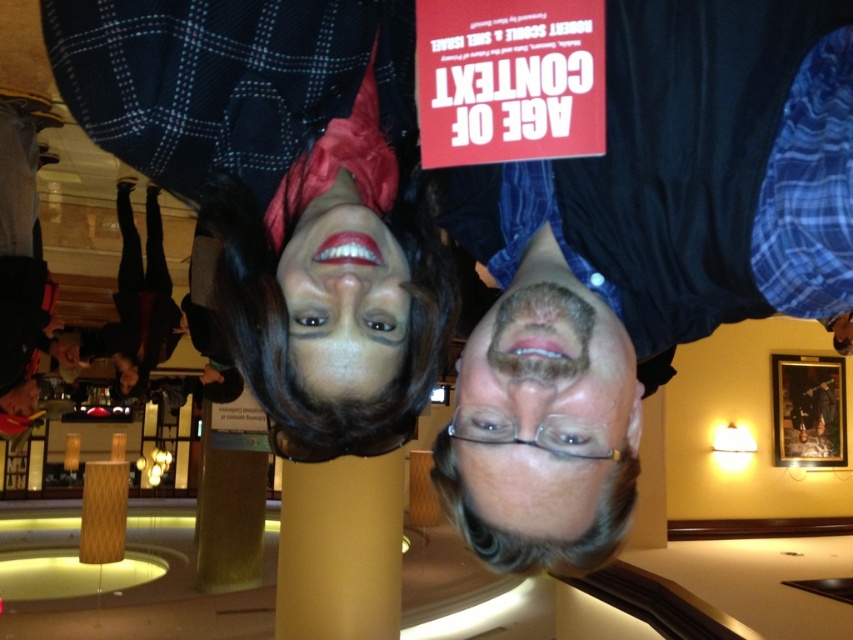
You are a photographer trying to capture a closeup shot of both the dark blue shirt at center and the matte black wig at center. Given that your camera has a maximum focus range of 7 inches, will you be able to fit both subjects within the frame without moving the camera?

The dark blue shirt at center and matte black wig at center are 7.47 inches apart, which exceeds the camera maximum focus range of 7 inches. Therefore, you cannot fit both subjects within the frame without moving the camera.

From the picture: You are a photographer trying to capture a group photo in the same setting as the image. You notice the dark blue shirt at center and the gray hair at center. Which of these two features would you need to adjust your focus on first if you want to ensure both are in the frame?

The dark blue shirt at center has a larger width than the gray hair at center, so you should focus on the dark blue shirt at center first to ensure it fits within the frame.

You are standing in the hotel lobby and want to take a photo of the dark blue shirt at center. Where should you position yourself to capture it in the frame?

The dark blue shirt at center is located at point (643,257), so you should position yourself directly in front of that coordinate to capture it in the frame.